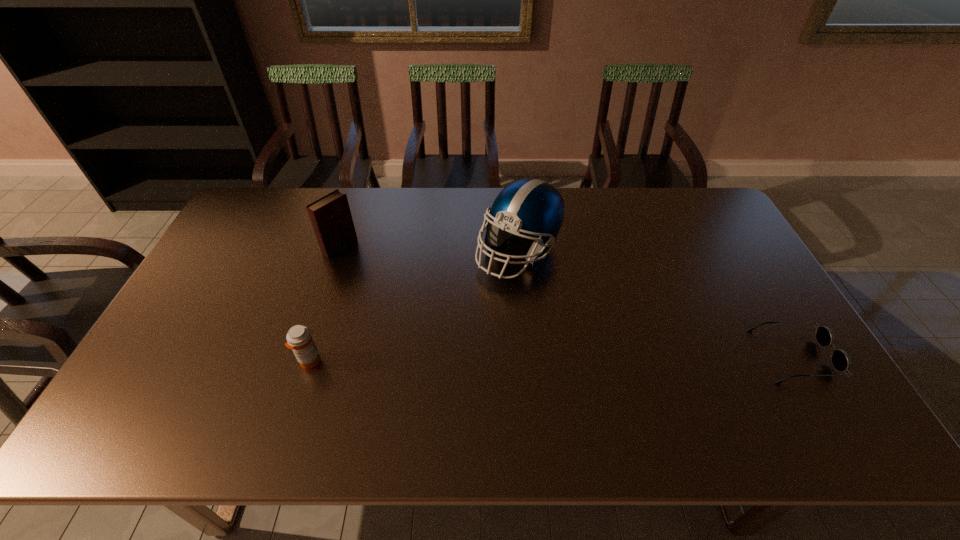
Identify the location of free spot on the desktop that is between the second shortest object and the rightmost object and is positioned at the front of the second object from right to left with the faceguard. (536, 359).

At what (x,y) coordinates should I click in order to perform the action: click on vacant space on the desktop that is between the third tallest object and the shortest object and is positioned on the front cover of the diary. Please return your answer as a coordinate pair (x, y). The height and width of the screenshot is (540, 960). Looking at the image, I should click on (505, 359).